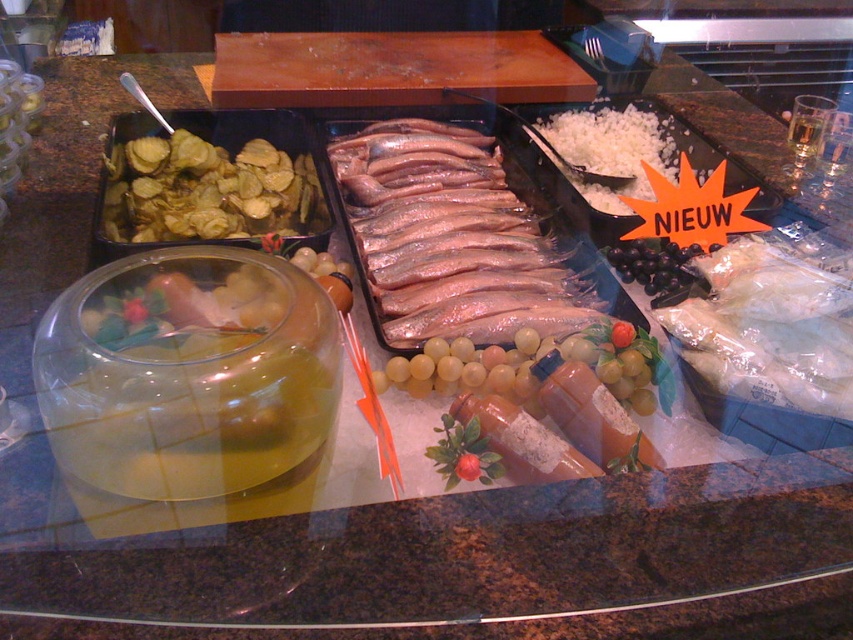
Question: Based on their relative distances, which object is nearer to the green crispy chips at left?

Choices:
 (A) translucent glass beverage at upper right
 (B) white crumbly cheese at upper right
 (C) black glossy grapes at center

Answer: (B)

Question: Which point is farther to the camera?

Choices:
 (A) (798, 122)
 (B) (683, 275)
 (C) (606, 145)

Answer: (A)

Question: Which of the following is the closest to the observer?

Choices:
 (A) (570, 316)
 (B) (158, 173)

Answer: (A)

Question: Can you confirm if white crumbly cheese at upper right is positioned below translucent glass beverage at upper right?

Choices:
 (A) no
 (B) yes

Answer: (B)

Question: Can you confirm if pinkish-silver fish at center is bigger than white plastic bag at center right?

Choices:
 (A) no
 (B) yes

Answer: (B)

Question: Is black glossy grapes at center to the right of translucent glass beverage at upper right from the viewer's perspective?

Choices:
 (A) yes
 (B) no

Answer: (B)